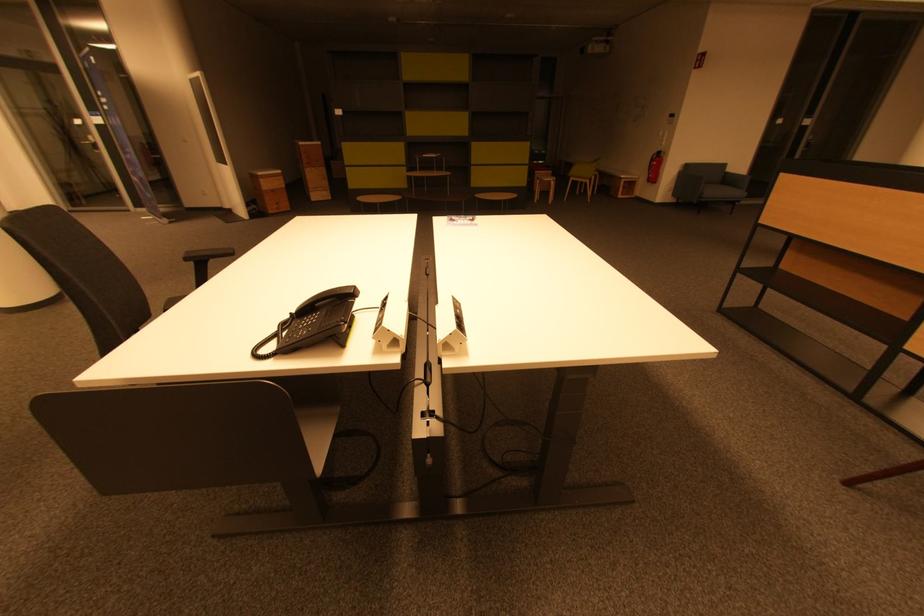
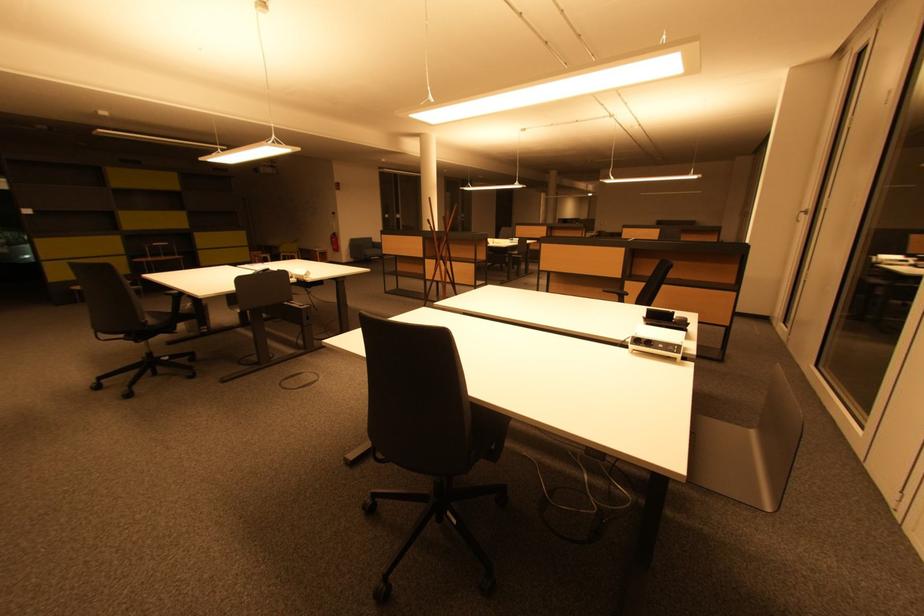
Where in the second image is the point corresponding to pixel 660 164 from the first image?

(338, 241)